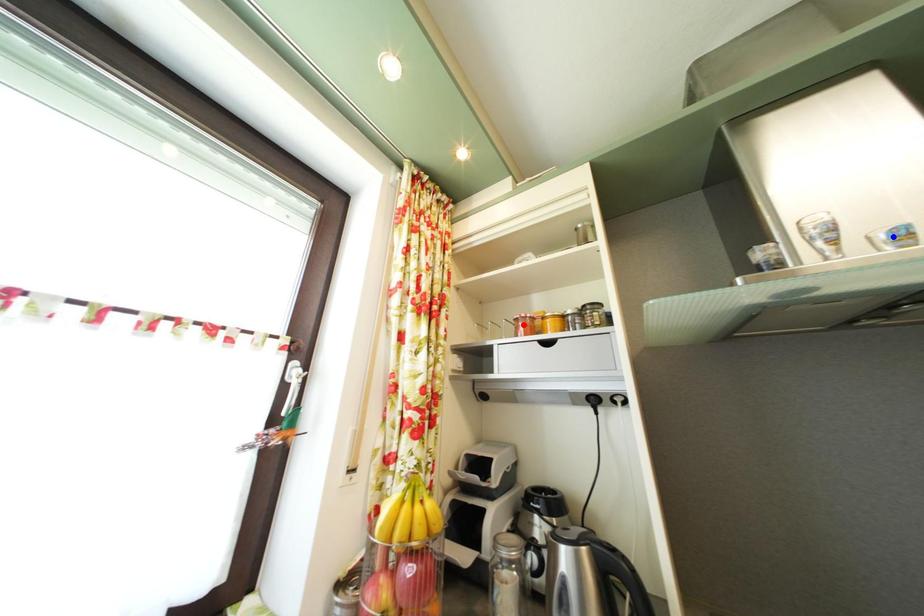
Question: In the image, two points are highlighted. Which point is nearer to the camera? Reply with the corresponding letter.

Choices:
 (A) blue point
 (B) red point

Answer: (A)